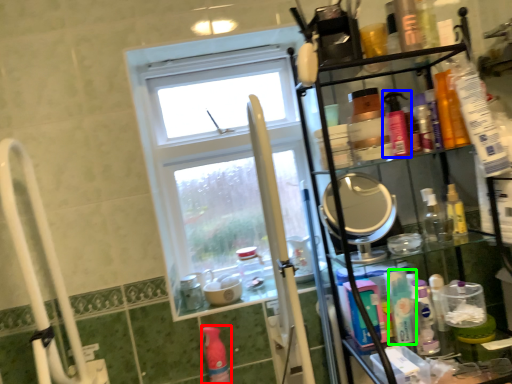
Question: Based on their relative distances, which object is farther from cleaning product (highlighted by a red box)? Choose from mouthwash (highlighted by a blue box) and mouthwash (highlighted by a green box).

Choices:
 (A) mouthwash
 (B) mouthwash

Answer: (A)